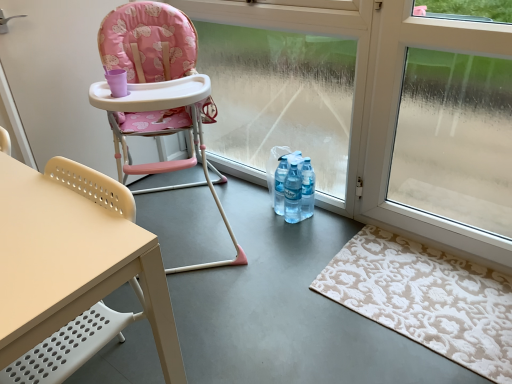
Where is `vacant space in front of transparent glass window at center`? This screenshot has width=512, height=384. vacant space in front of transparent glass window at center is located at coordinates (297, 258).